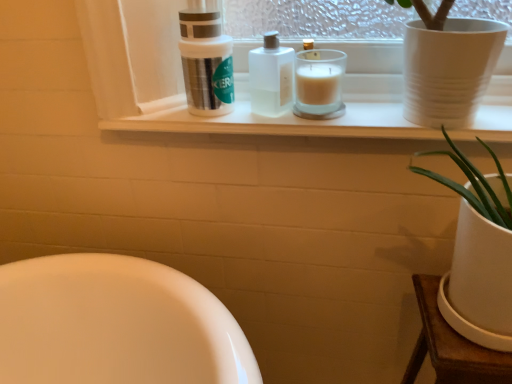
This screenshot has width=512, height=384. In order to click on free spot above white matte window sill at upper center (from a real-world perspective) in this screenshot , I will do `click(293, 117)`.